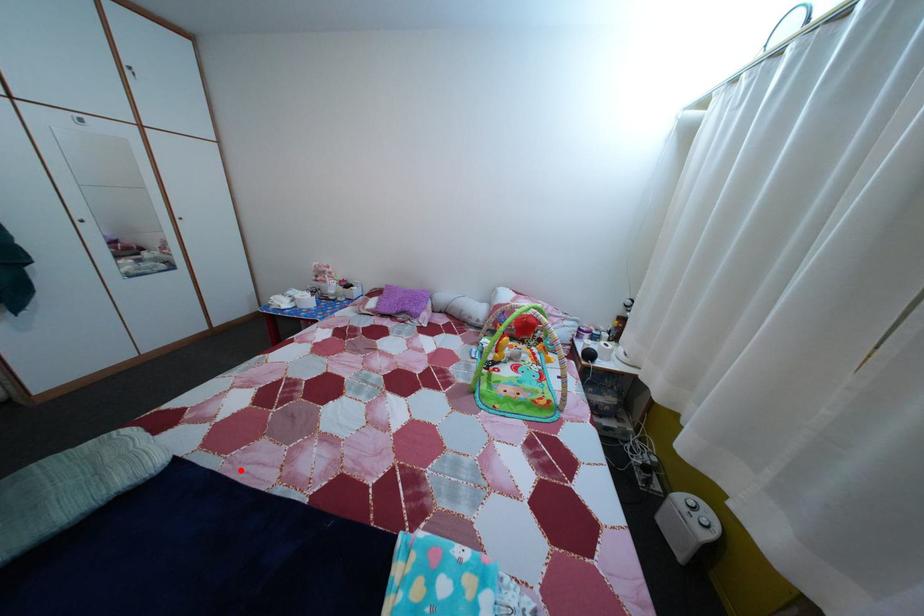
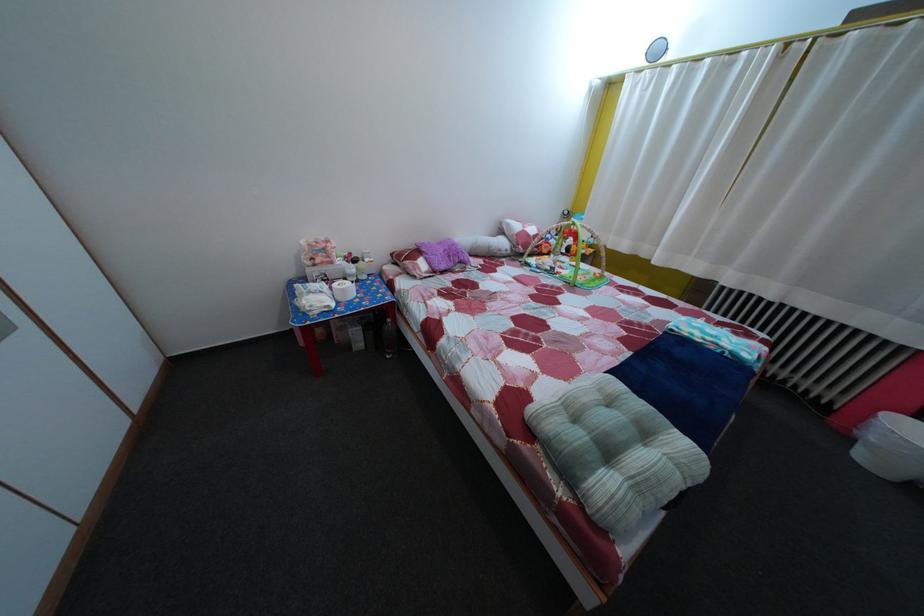
The point at the highlighted location is marked in the first image. Where is the corresponding point in the second image?

(601, 379)